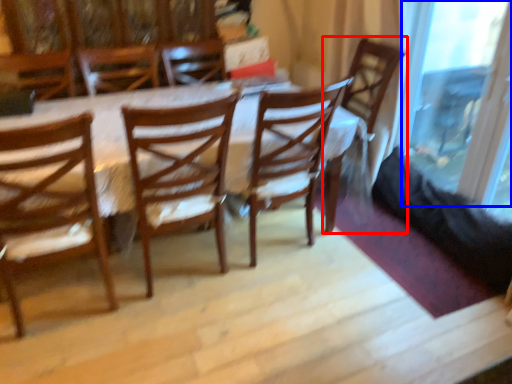
Question: Among these objects, which one is farthest to the camera, chair (highlighted by a red box) or glass door (highlighted by a blue box)?

Choices:
 (A) chair
 (B) glass door

Answer: (A)